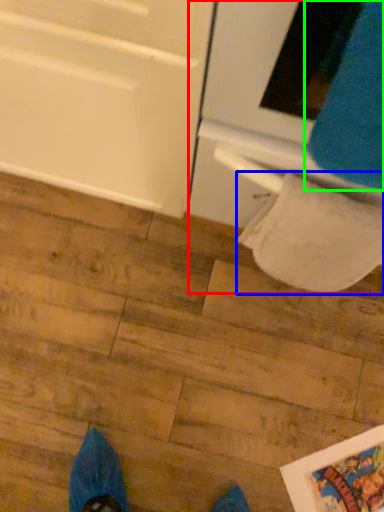
Question: Which is nearer to the oven (highlighted by a red box)? toilet paper (highlighted by a blue box) or sweat pant (highlighted by a green box).

Choices:
 (A) toilet paper
 (B) sweat pant

Answer: (A)